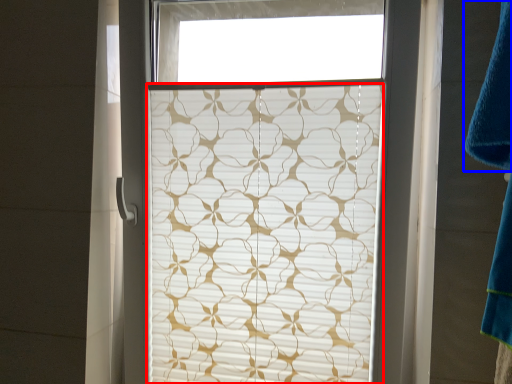
Question: Among these objects, which one is farthest to the camera, window blind (highlighted by a red box) or bath towel (highlighted by a blue box)?

Choices:
 (A) window blind
 (B) bath towel

Answer: (A)